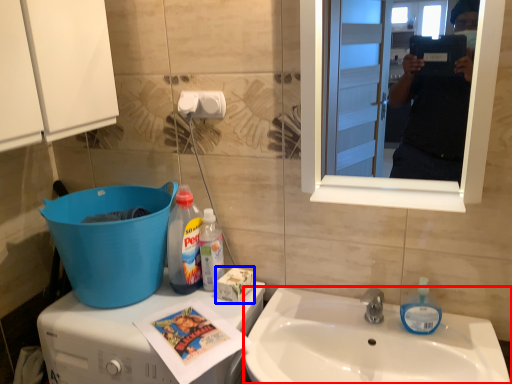
Question: Which object is closer to the camera taking this photo, sink (highlighted by a red box) or box (highlighted by a blue box)?

Choices:
 (A) sink
 (B) box

Answer: (A)